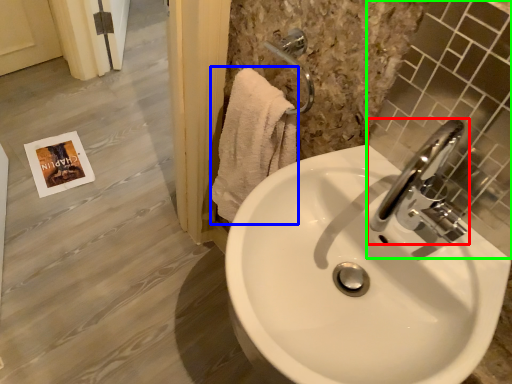
Question: Which is farther away from tap (highlighted by a red box)? bath towel (highlighted by a blue box) or mirror (highlighted by a green box)?

Choices:
 (A) bath towel
 (B) mirror

Answer: (A)